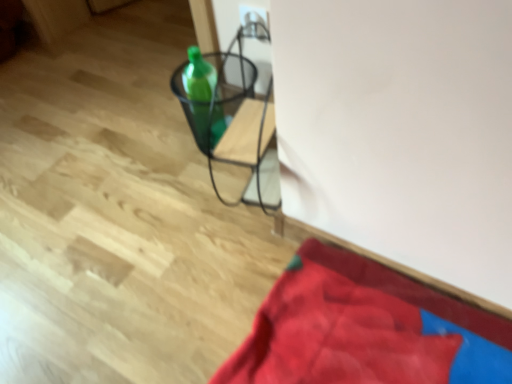
Question: Can you confirm if metallic wire basket at center is wider than green glass bottle at center?

Choices:
 (A) no
 (B) yes

Answer: (B)

Question: Does metallic wire basket at center have a larger size compared to green glass bottle at center?

Choices:
 (A) yes
 (B) no

Answer: (A)

Question: From a real-world perspective, is metallic wire basket at center located higher than green glass bottle at center?

Choices:
 (A) no
 (B) yes

Answer: (A)

Question: Is metallic wire basket at center positioned before green glass bottle at center?

Choices:
 (A) yes
 (B) no

Answer: (A)

Question: Is metallic wire basket at center oriented away from green glass bottle at center?

Choices:
 (A) yes
 (B) no

Answer: (A)

Question: Is green glass bottle at center in front of or behind metallic wire basket at center in the image?

Choices:
 (A) front
 (B) behind

Answer: (B)

Question: From a real-world perspective, relative to metallic wire basket at center, is green glass bottle at center vertically above or below?

Choices:
 (A) below
 (B) above

Answer: (B)

Question: Would you say green glass bottle at center is inside or outside metallic wire basket at center?

Choices:
 (A) outside
 (B) inside

Answer: (B)

Question: Is green glass bottle at center taller or shorter than metallic wire basket at center?

Choices:
 (A) short
 (B) tall

Answer: (B)

Question: Is point (340, 258) positioned closer to the camera than point (264, 97)?

Choices:
 (A) farther
 (B) closer

Answer: (B)

Question: Is velvety red blanket at lower right inside the boundaries of metallic wire basket at center, or outside?

Choices:
 (A) inside
 (B) outside

Answer: (B)

Question: Looking at their shapes, would you say velvety red blanket at lower right is wider or thinner than metallic wire basket at center?

Choices:
 (A) wide
 (B) thin

Answer: (A)

Question: Looking at the image, does velvety red blanket at lower right seem bigger or smaller compared to metallic wire basket at center?

Choices:
 (A) small
 (B) big

Answer: (B)

Question: Would you say metallic wire basket at center is inside or outside green glass bottle at center?

Choices:
 (A) inside
 (B) outside

Answer: (B)

Question: Is point (229, 187) positioned closer to the camera than point (183, 84)?

Choices:
 (A) farther
 (B) closer

Answer: (A)